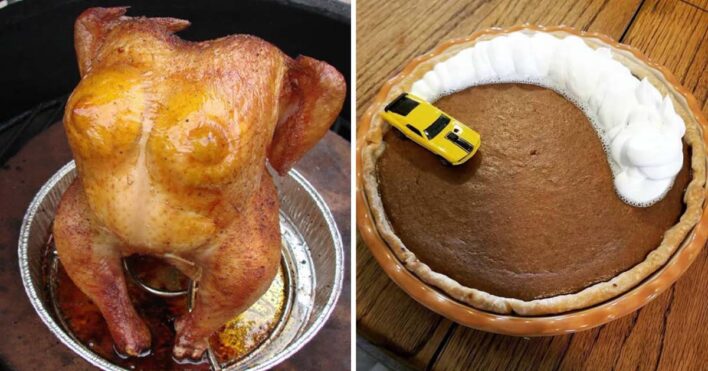
I want to click on wooden table top, so click(x=468, y=15), click(x=336, y=179).